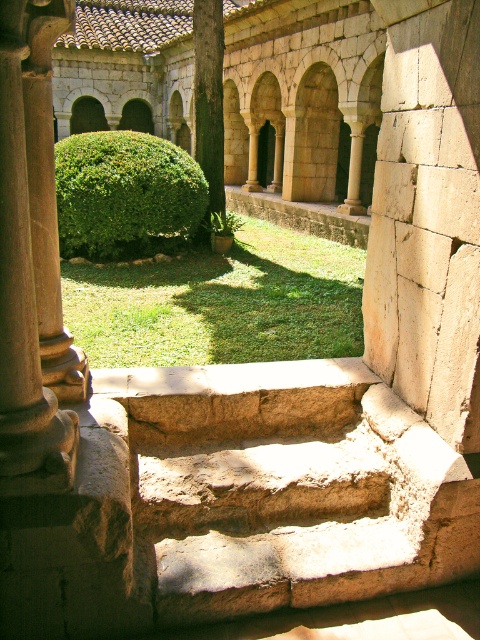
Question: Which point is farther from the camera taking this photo?

Choices:
 (A) (35, 64)
 (B) (178, 248)
 (C) (99, 332)
 (D) (195, 60)

Answer: (D)

Question: From the image, what is the correct spatial relationship of green grass at center in relation to green leafy hedge at center?

Choices:
 (A) above
 (B) below

Answer: (B)

Question: Which point appears closest to the camera in this image?

Choices:
 (A) (57, 200)
 (B) (264, 266)

Answer: (A)

Question: Can you confirm if green grass at center is positioned below green textured pillar at center?

Choices:
 (A) no
 (B) yes

Answer: (B)

Question: Which point is closer to the camera?

Choices:
 (A) (95, 189)
 (B) (192, 294)

Answer: (B)

Question: Is natural stone steps at center to the right of green grass at center from the viewer's perspective?

Choices:
 (A) yes
 (B) no

Answer: (A)